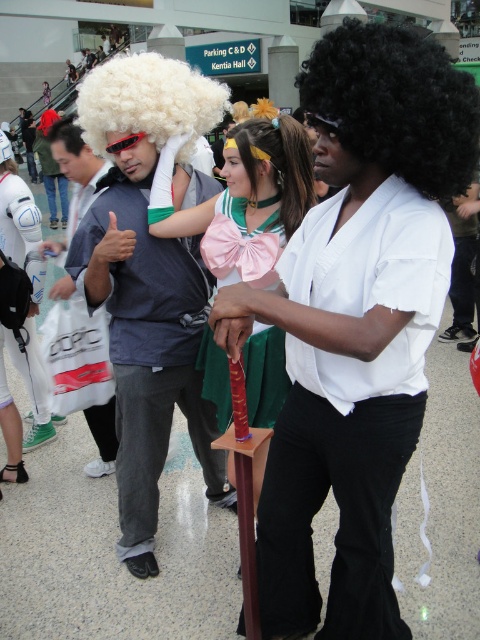
Does black curly wig at center lie in front of matte black wig at left?

Yes, black curly wig at center is in front of matte black wig at left.

Between point (399, 86) and point (99, 472), which one is positioned in front?

Positioned in front is point (399, 86).

Who is more forward, (362,120) or (74,138)?

Positioned in front is point (362,120).

Where is `black curly wig at center`? This screenshot has height=640, width=480. black curly wig at center is located at coordinates (396, 104).

Consider the image. Which is above, white curly wig at upper left or matte black wig at left?

white curly wig at upper left

Between point (146, 124) and point (54, 291), which one is positioned behind?

The point (54, 291) is behind.

Which is in front, point (116, 72) or point (63, 138)?

Point (116, 72) is more forward.

At what (x,y) coordinates should I click in order to perform the action: click on white curly wig at upper left. Please return your answer as a coordinate pair (x, y). Looking at the image, I should click on (148, 100).

Looking at this image, between white fluffy wig at center and pink satin bow at center, which one appears on the left side from the viewer's perspective?

white fluffy wig at center

Can you confirm if white fluffy wig at center is positioned to the right of pink satin bow at center?

No, white fluffy wig at center is not to the right of pink satin bow at center.

Locate an element on the screen. This screenshot has width=480, height=640. white fluffy wig at center is located at coordinates (146, 284).